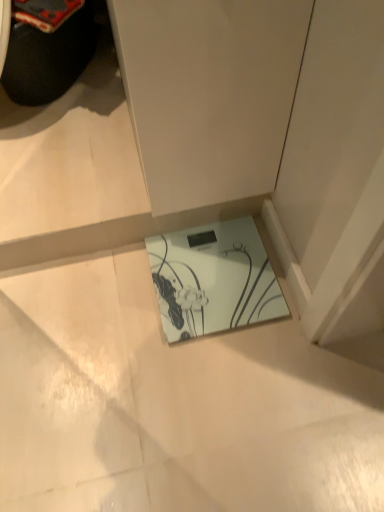
The width and height of the screenshot is (384, 512). Describe the element at coordinates (213, 279) in the screenshot. I see `white glossy scale at center` at that location.

This screenshot has width=384, height=512. I want to click on white glossy scale at center, so 213,279.

Measure the distance between point (256, 298) and camera.

They are 1.03 meters apart.

This screenshot has width=384, height=512. I want to click on white glossy scale at center, so click(x=213, y=279).